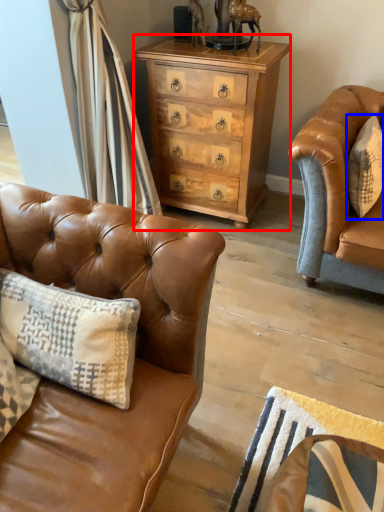
Question: Which point is closer to the camera, chest of drawers (highlighted by a red box) or pillow (highlighted by a blue box)?

Choices:
 (A) chest of drawers
 (B) pillow

Answer: (B)